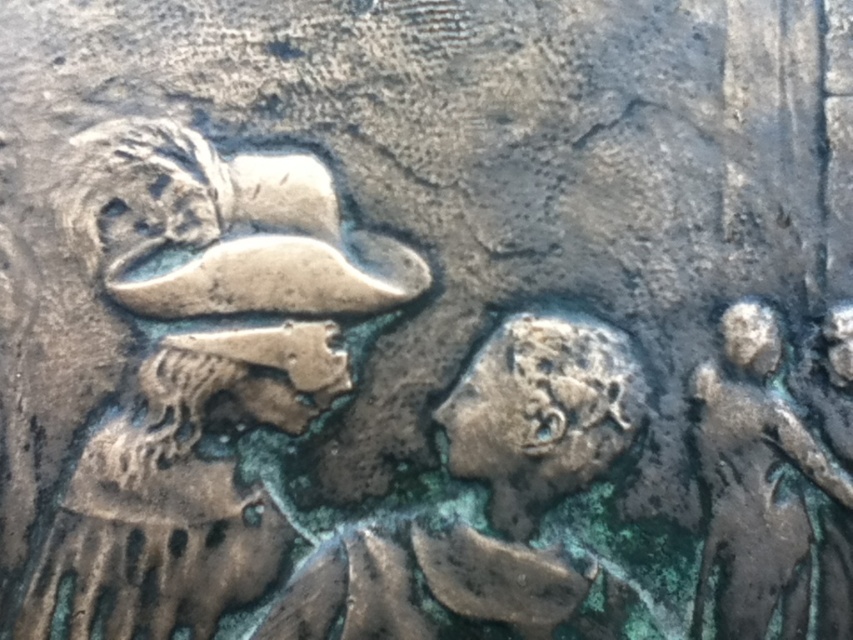
Question: Does bronze textured bust at left come in front of green patina figure at right?

Choices:
 (A) no
 (B) yes

Answer: (B)

Question: Among these points, which one is nearest to the camera?

Choices:
 (A) (277, 301)
 (B) (722, 403)

Answer: (A)

Question: Is bronze textured bust at left bigger than green patina figure at right?

Choices:
 (A) no
 (B) yes

Answer: (B)

Question: Which point appears closest to the camera in this image?

Choices:
 (A) (221, 385)
 (B) (793, 632)

Answer: (B)

Question: From the image, what is the correct spatial relationship of bronze textured bust at left in relation to green patina figure at right?

Choices:
 (A) below
 (B) above

Answer: (B)